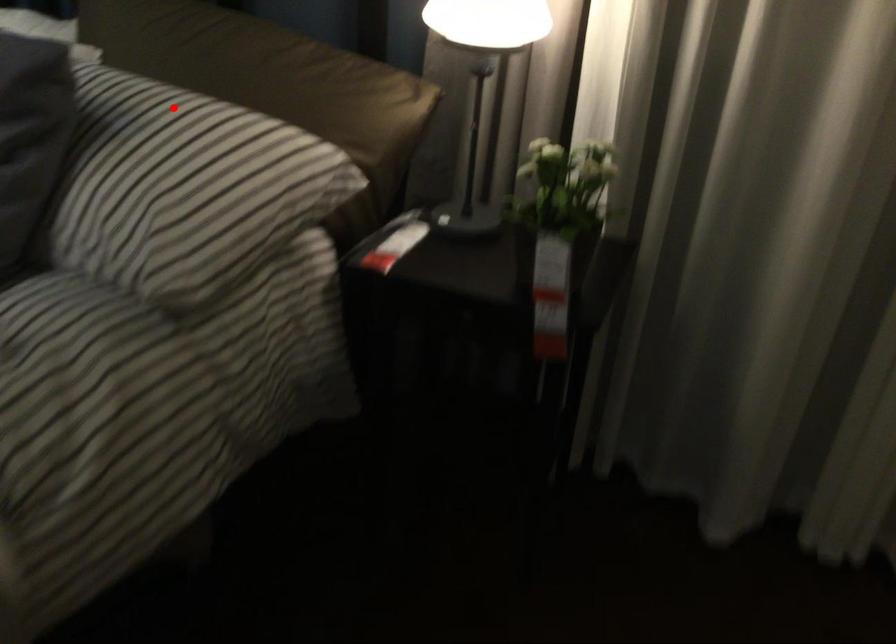
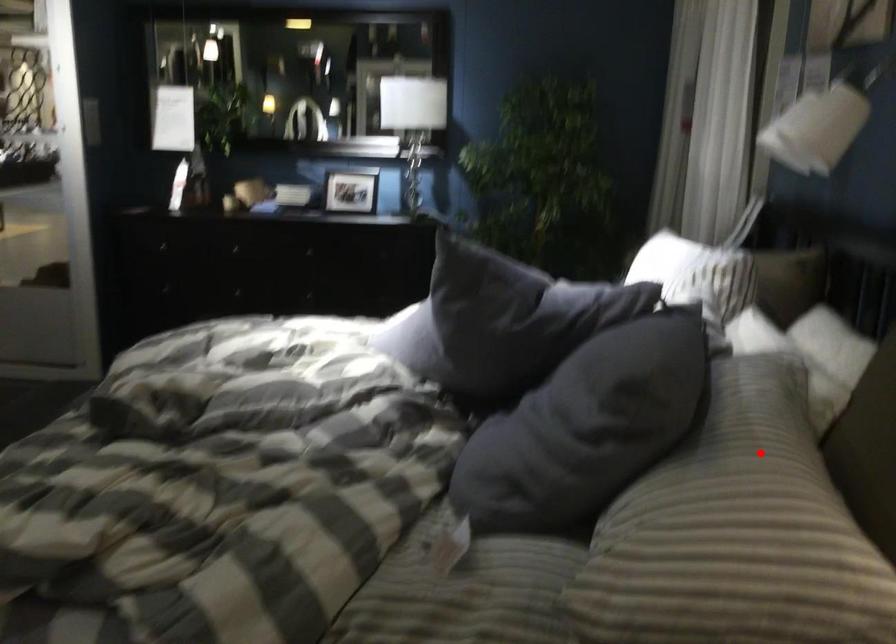
From the picture: I am providing you with two images of the same scene from different viewpoints. A red point is marked on the first image and another point is marked on the second image. Are the points marked in image1 and image2 representing the same 3D position?

Yes